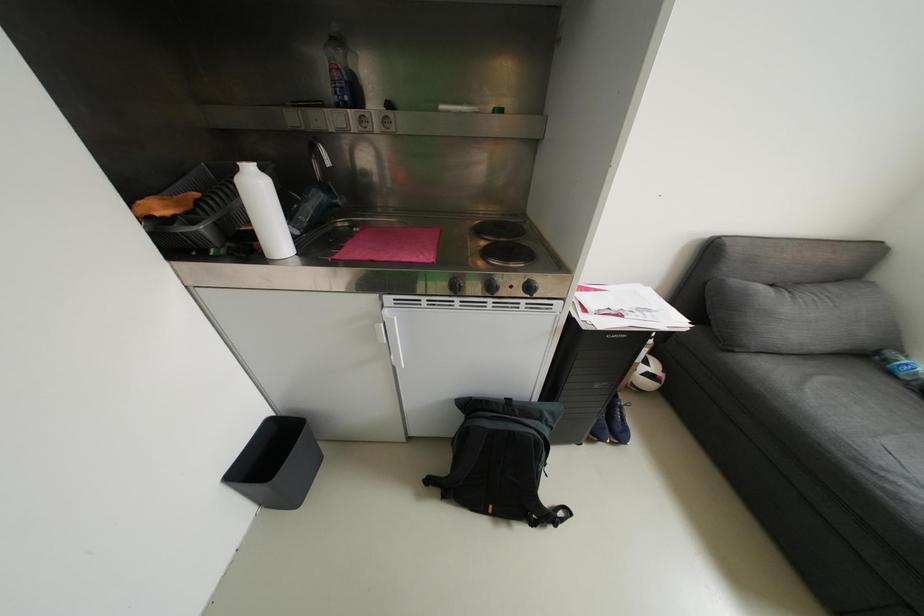
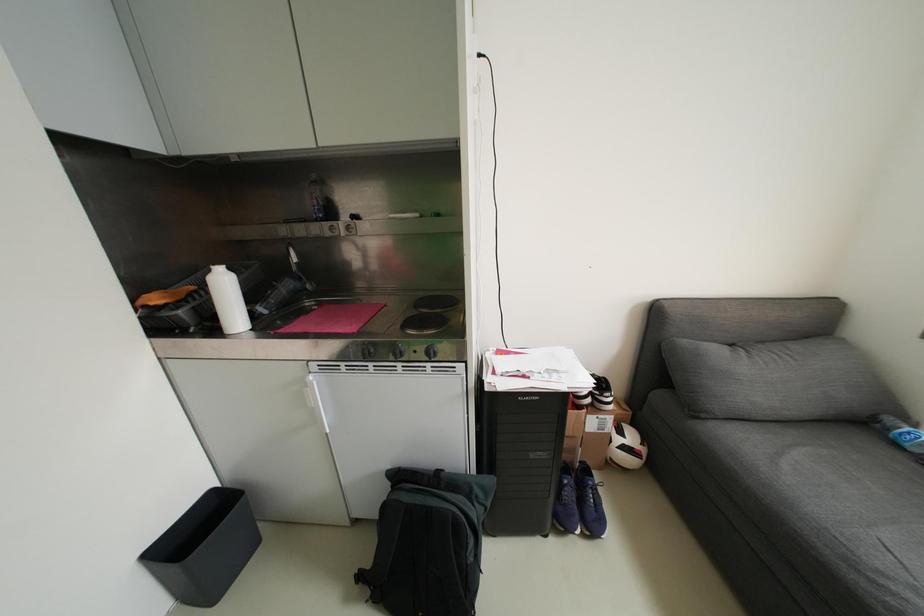
Question: The images are taken continuously from a first-person perspective. In which direction is your viewpoint rotating?

Choices:
 (A) Left
 (B) Right
 (C) Up
 (D) Down

Answer: (C)